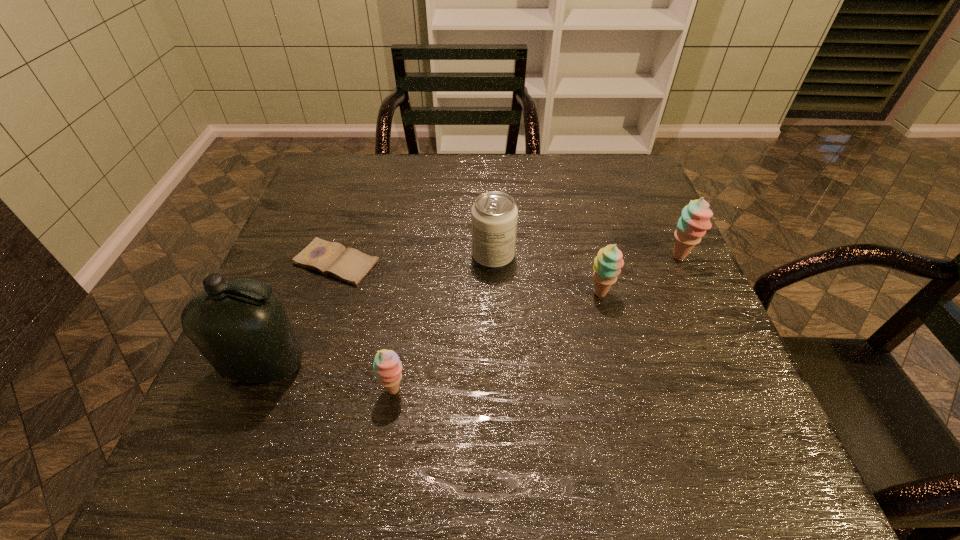
Find the location of a particular element. The width and height of the screenshot is (960, 540). the shortest sherbert is located at coordinates click(388, 368).

Locate an element on the screen. Image resolution: width=960 pixels, height=540 pixels. the nearest sherbert is located at coordinates (388, 368).

What are the coordinates of `the second shortest sherbert` in the screenshot? It's located at (607, 266).

This screenshot has height=540, width=960. I want to click on the second sherbert from right to left, so click(607, 266).

This screenshot has width=960, height=540. I want to click on the rightmost object, so click(695, 218).

At what (x,y) coordinates should I click in order to perform the action: click on the farthest sherbert. Please return your answer as a coordinate pair (x, y). The image size is (960, 540). Looking at the image, I should click on (695, 218).

This screenshot has width=960, height=540. What are the coordinates of `the shortest object` in the screenshot? It's located at (350, 265).

The image size is (960, 540). Identify the location of the fourth object from left to right. (494, 215).

Locate an element on the screen. bottle is located at coordinates (240, 326).

Locate an element on the screen. The width and height of the screenshot is (960, 540). free point located on the right of the nearest sherbert is located at coordinates point(485,390).